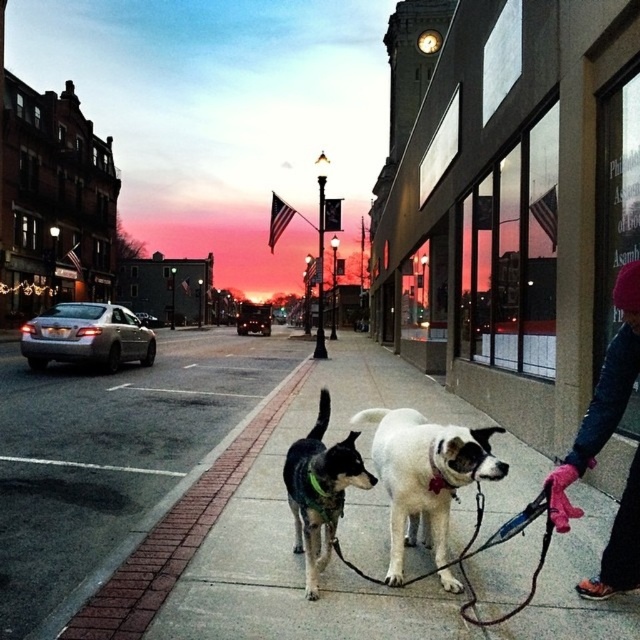
Question: Estimate the real-world distances between objects in this image. Which object is farther from the concrete sidewalk at center?

Choices:
 (A) black and white fur at center
 (B) black nylon leash at center
 (C) pink fleece gloves at lower right

Answer: (C)

Question: Which point is closer to the camera?

Choices:
 (A) brick pavement at center
 (B) white fur dog at center

Answer: (B)

Question: Is pink fleece gloves at lower right behind black and white fur at center?

Choices:
 (A) yes
 (B) no

Answer: (B)

Question: Is white fur dog at center smaller than black and white fur at center?

Choices:
 (A) no
 (B) yes

Answer: (A)

Question: Considering the relative positions of concrete sidewalk at center and white fur dog at center in the image provided, where is concrete sidewalk at center located with respect to white fur dog at center?

Choices:
 (A) right
 (B) left

Answer: (A)

Question: Which point is farther to the camera?

Choices:
 (A) concrete sidewalk at center
 (B) black and white fur at center
 (C) pink fleece gloves at lower right
 (D) white fur dog at center

Answer: (B)